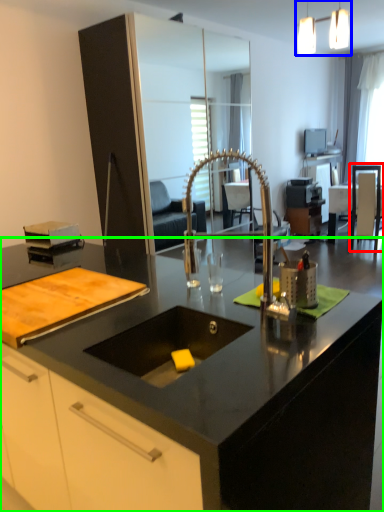
Question: Which object is the closest to the armchair (highlighted by a red box)? Choose among these: light fixture (highlighted by a blue box) or countertop (highlighted by a green box).

Choices:
 (A) light fixture
 (B) countertop

Answer: (A)